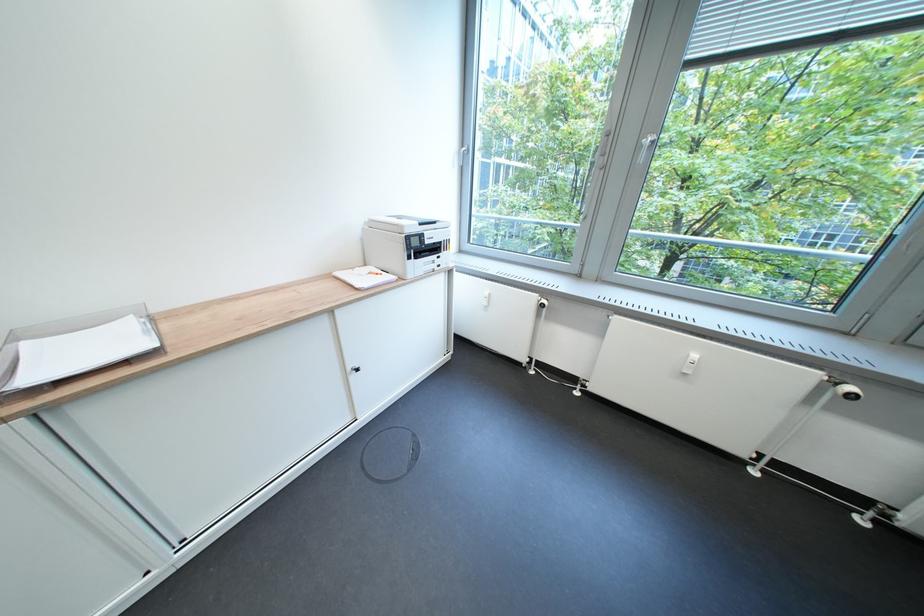
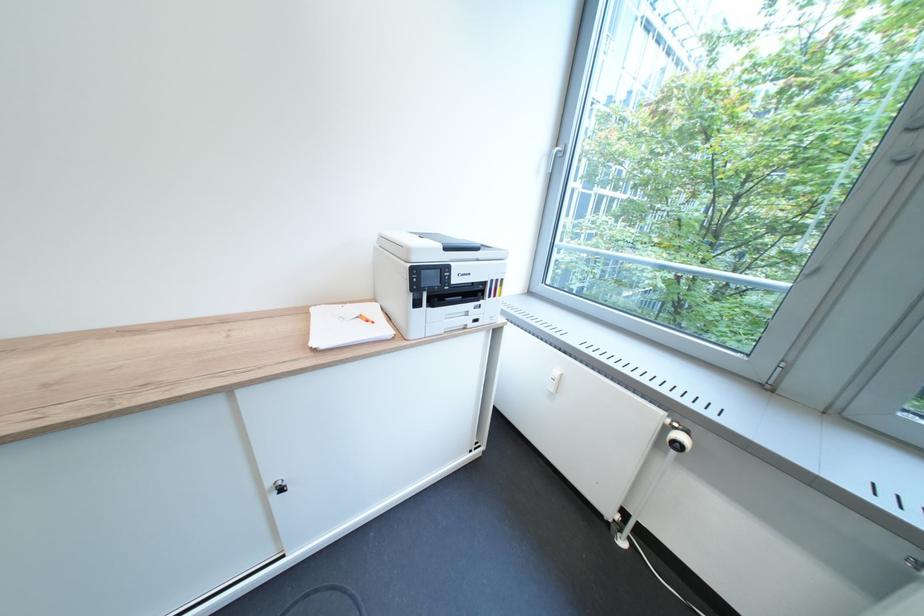
The point at (x=432, y=225) is marked in the first image. Where is the corresponding point in the second image?

(458, 249)